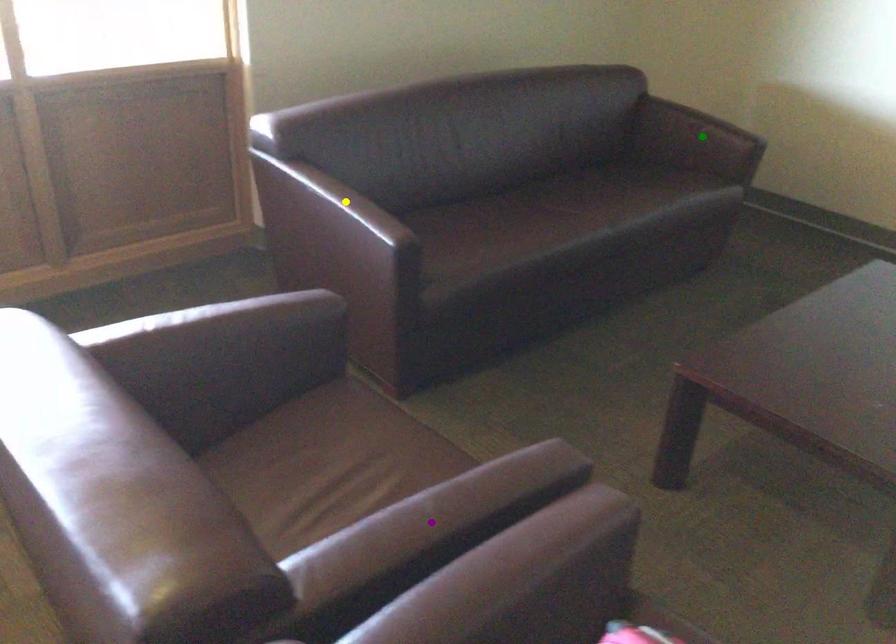
Order these from nearest to farthest:
- yellow point
- purple point
- green point

purple point
yellow point
green point